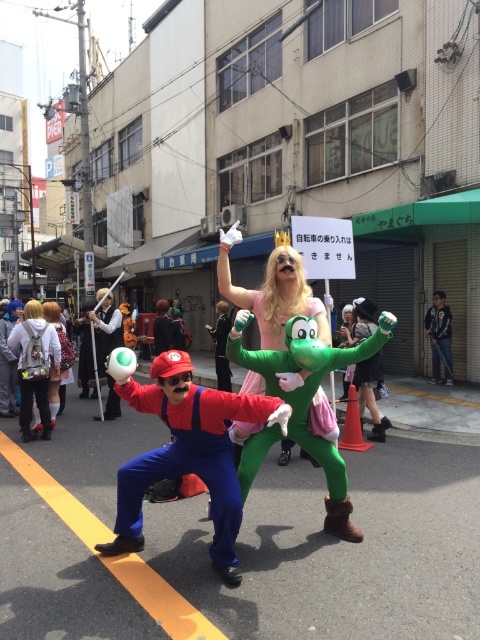
Is point (168, 406) positioned after point (223, 388)?

No, (168, 406) is in front of (223, 388).

Is the position of matte red fabric mario at center more distant than that of green rubber boots at center?

No, matte red fabric mario at center is in front of green rubber boots at center.

I want to click on matte red fabric mario at center, so click(x=188, y=452).

Which is above, white plush backpack at center or shiny silver sword at center?

shiny silver sword at center is higher up.

Who is taller, white plush backpack at center or shiny silver sword at center?

Standing taller between the two is white plush backpack at center.

The height and width of the screenshot is (640, 480). What do you see at coordinates (35, 365) in the screenshot? I see `white plush backpack at center` at bounding box center [35, 365].

Where is `white plush backpack at center`? Image resolution: width=480 pixels, height=640 pixels. white plush backpack at center is located at coordinates pyautogui.click(x=35, y=365).

Between point (108, 352) and point (345, 305), which one is positioned behind?

Point (345, 305)

Does shiny silver sword at center have a larger size compared to green rubber gloves at center?

Yes, shiny silver sword at center is bigger than green rubber gloves at center.

In order to click on shiny silver sword at center in this screenshot , I will do `click(107, 339)`.